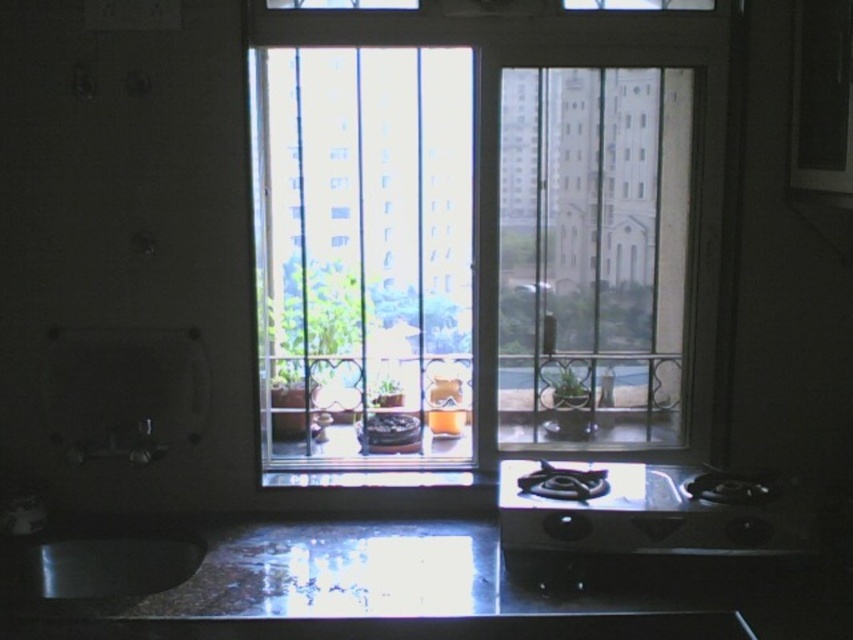
Does shiny metallic sink at lower left have a larger size compared to green matte plant at center?

Indeed, shiny metallic sink at lower left has a larger size compared to green matte plant at center.

Can you confirm if shiny metallic sink at lower left is positioned above green matte plant at center?

No.

Where is `shiny metallic sink at lower left`? This screenshot has height=640, width=853. shiny metallic sink at lower left is located at coordinates pos(96,564).

Locate an element on the screen. This screenshot has height=640, width=853. shiny metallic sink at lower left is located at coordinates (96, 564).

Does point (525, 269) come behind point (850, 624)?

Yes, it is behind point (850, 624).

Does clear glass window at center have a larger size compared to glossy granite counter top at lower center?

Yes.

Identify the location of clear glass window at center. The height and width of the screenshot is (640, 853). (480, 227).

Who is shorter, clear glass window at center or green matte plant at center?

green matte plant at center is shorter.

Does clear glass window at center have a greater height compared to green matte plant at center?

Indeed, clear glass window at center has a greater height compared to green matte plant at center.

What do you see at coordinates (480, 227) in the screenshot? The height and width of the screenshot is (640, 853). I see `clear glass window at center` at bounding box center [480, 227].

Identify the location of clear glass window at center. The height and width of the screenshot is (640, 853). (480, 227).